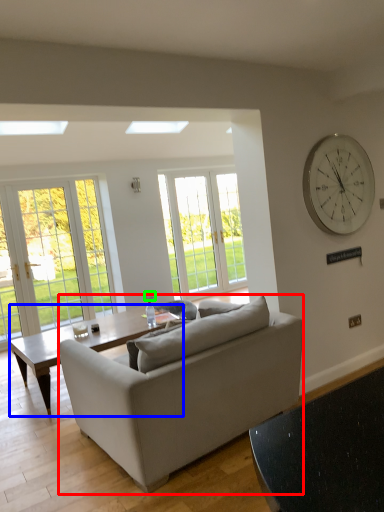
Question: Based on their relative distances, which object is nearer to studio couch (highlighted by a red box)? Choose from coffee table (highlighted by a blue box) and power outlet (highlighted by a green box).

Choices:
 (A) coffee table
 (B) power outlet

Answer: (A)